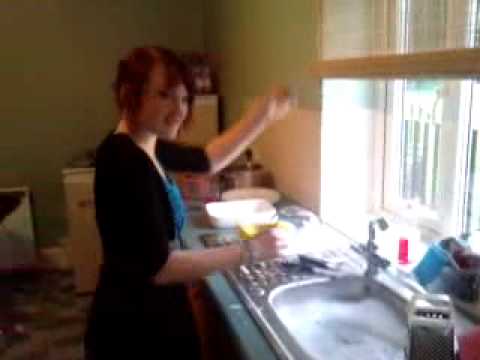
Where is `window`? window is located at coordinates (424, 131).